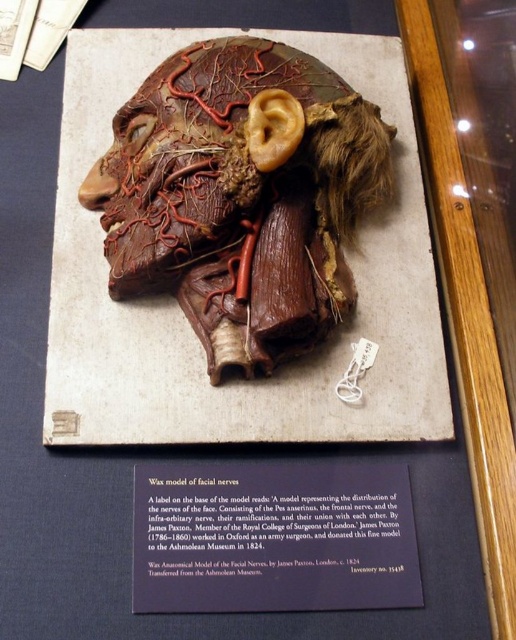
Question: Does matte brown wax model of facial nerves at center appear on the right side of purple paper at center?

Choices:
 (A) yes
 (B) no

Answer: (B)

Question: Which point is farther to the camera?

Choices:
 (A) (365, 564)
 (B) (204, 275)

Answer: (B)

Question: Can you confirm if matte brown wax model of facial nerves at center is smaller than purple paper at center?

Choices:
 (A) no
 (B) yes

Answer: (A)

Question: Where is matte brown wax model of facial nerves at center located in relation to purple paper at center in the image?

Choices:
 (A) left
 (B) right

Answer: (A)

Question: Which of the following is the farthest from the observer?

Choices:
 (A) purple paper at center
 (B) matte brown wax model of facial nerves at center

Answer: (B)